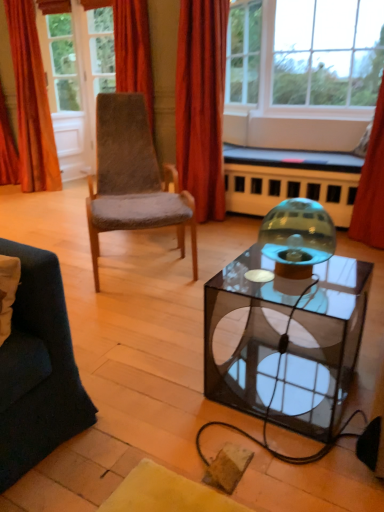
The height and width of the screenshot is (512, 384). Identify the location of vacant area that is in front of transparent glass table at center. (295, 463).